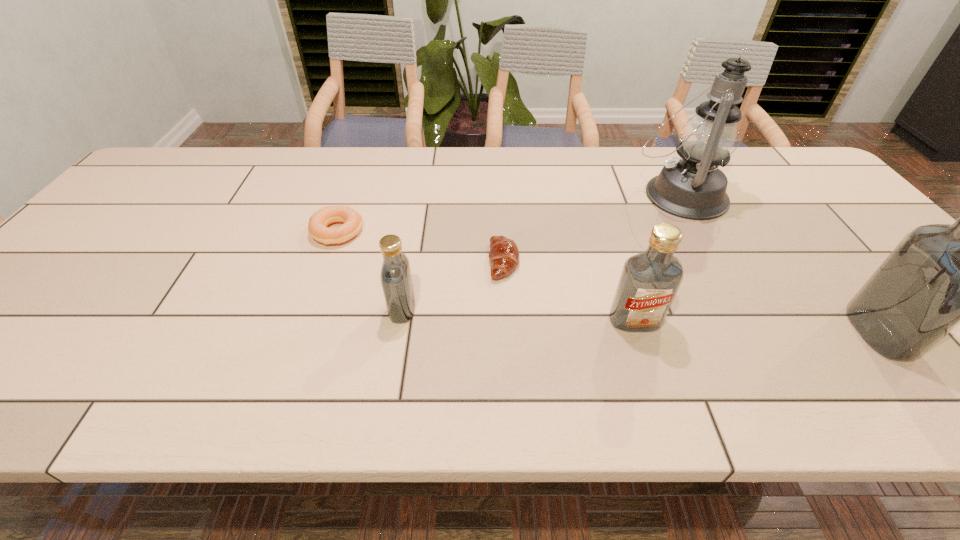
At what (x,y) coordinates should I click in order to perform the action: click on the second object from left to right. Please return your answer as a coordinate pair (x, y). The width and height of the screenshot is (960, 540). Looking at the image, I should click on (396, 279).

At what (x,y) coordinates should I click in order to perform the action: click on the fourth tallest object. Please return your answer as a coordinate pair (x, y). Looking at the image, I should click on (396, 279).

I want to click on the second tallest vodka, so click(x=649, y=281).

Where is `the third tallest object`? This screenshot has height=540, width=960. the third tallest object is located at coordinates (649, 281).

You are a GUI agent. You are given a task and a screenshot of the screen. Output one action in this format:
    pyautogui.click(x=<x>, y=<y>)
    Task: Click on the second tallest object
    
    Given the screenshot: What is the action you would take?
    pyautogui.click(x=941, y=275)

Locate an element on the screen. This screenshot has width=960, height=540. the rightmost vodka is located at coordinates (941, 275).

This screenshot has width=960, height=540. In order to click on the fifth object from left to right in this screenshot , I will do `click(693, 187)`.

The image size is (960, 540). Find the location of `crescent roll`. crescent roll is located at coordinates (504, 256).

Identify the location of the leftmost object. This screenshot has height=540, width=960. (318, 222).

At what (x,y) coordinates should I click in order to perform the action: click on vacant space located on the front-facing side of the shortest vodka. Please return your answer as a coordinate pair (x, y). The width and height of the screenshot is (960, 540). Looking at the image, I should click on (358, 309).